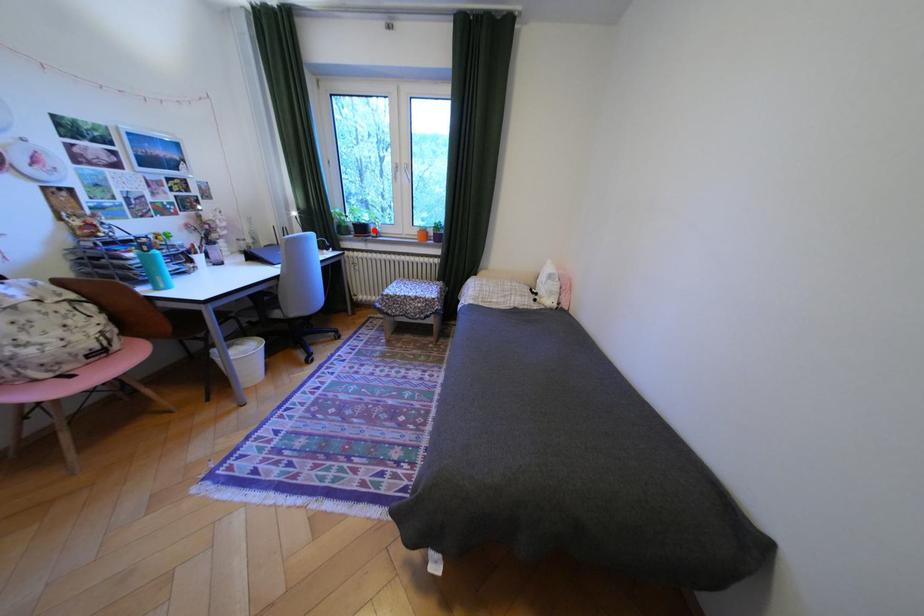
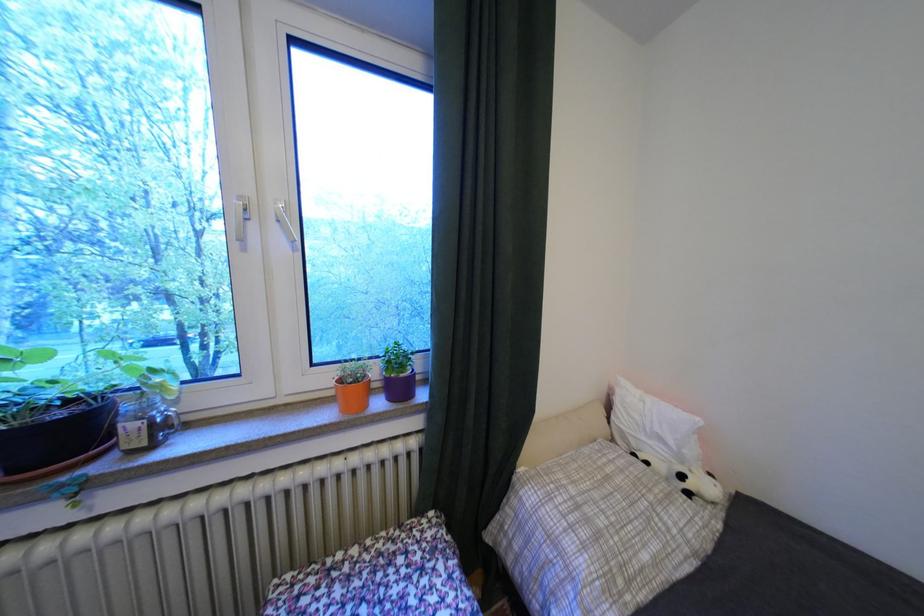
Question: I am providing you with two images of the same scene from different viewpoints. In image1, a red point is highlighted. Considering the same 3D point in image2, which of the following is correct?

Choices:
 (A) It is closer
 (B) It is farther

Answer: (B)